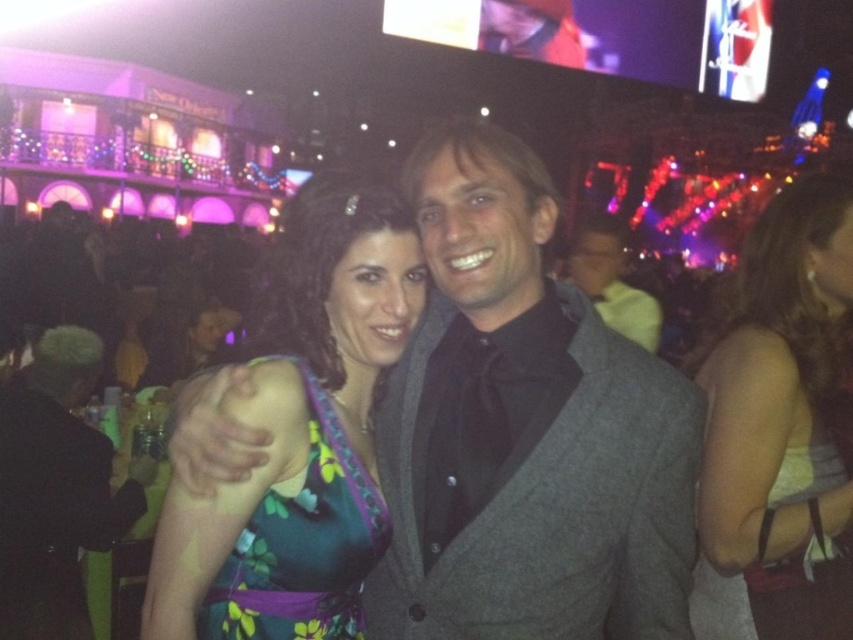
Where is the matte gray suit at center located in the image?

The matte gray suit at center is located at point 0.673 in the x coordinate and 0.615 in the y coordinate.

You are a photographer at the event and want to capture a photo of both the light brown fabric dress at right and the gray wool suit at center. Which of the two clothing items will appear taller in the photo?

The light brown fabric dress at right is much taller than the gray wool suit at center, so it will appear taller in the photo.